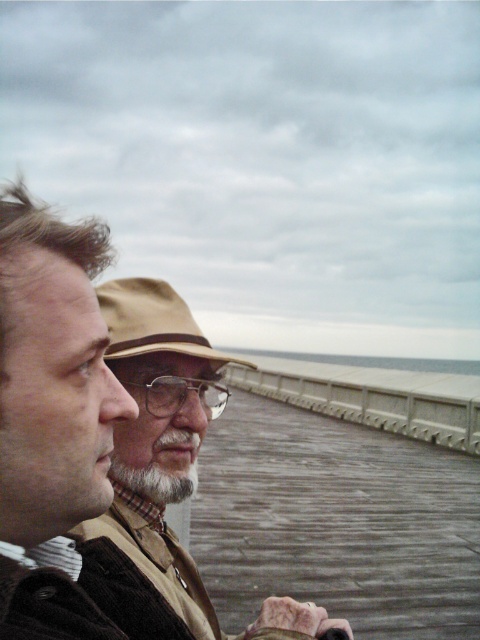
You are a photographer trying to capture a clear shot of both the tan felt hat at center and the graywoollybeard at center. Since you want both subjects to be in focus, which one should you adjust your camera focus on first?

The tan felt hat at center is much taller as graywoollybeard at center, so you should focus on the tan felt hat at center first to ensure both are in focus.

Where is the brown woolen sweater at center located in the image?

The brown woolen sweater at center is located at point (160,372).